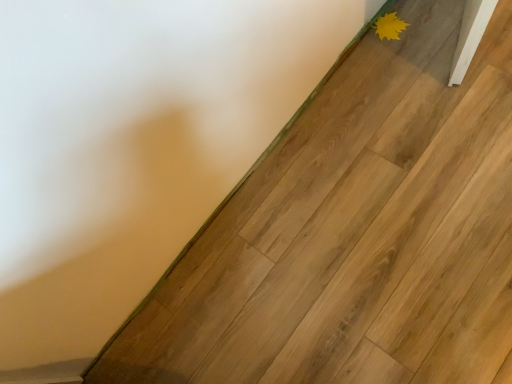
Where is `free location to the left of yellow matte maple leaf at upper right`? free location to the left of yellow matte maple leaf at upper right is located at coordinates (361, 59).